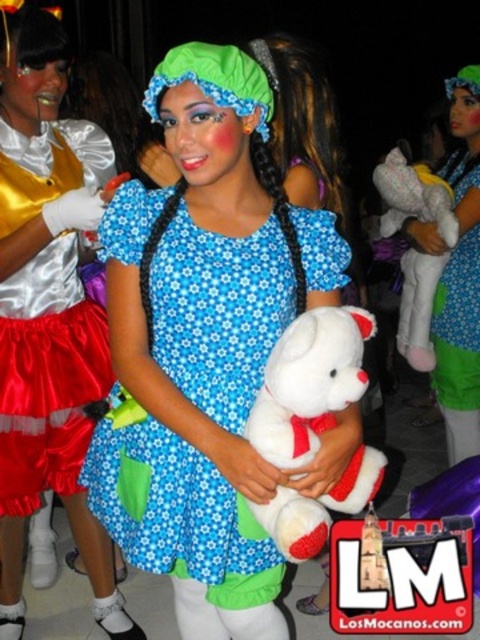
From the picture: You are standing at the front of the stage and want to hand a microphone to the person wearing the blue floral fabric dress at center. The microphone stand is 3 feet away from you. Can you reach the person without moving closer?

The blue floral fabric dress at center is 4.59 feet away from the camera, so the microphone stand being 3 feet away means you can reach them by extending your arm since 3 feet is closer than 4.59 feet.

Based on the scene description, where is the blue floral fabric dress at center located in terms of coordinates?

The blue floral fabric dress at center is located at coordinates point [219,312].